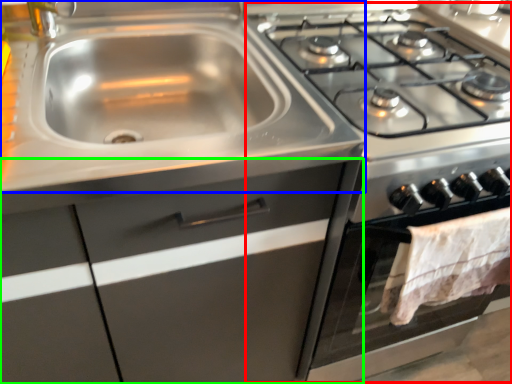
Question: Which object is the closest to the appliance (highlighted by a red box)? Choose among these: sink (highlighted by a blue box) or cabinetry (highlighted by a green box).

Choices:
 (A) sink
 (B) cabinetry

Answer: (B)